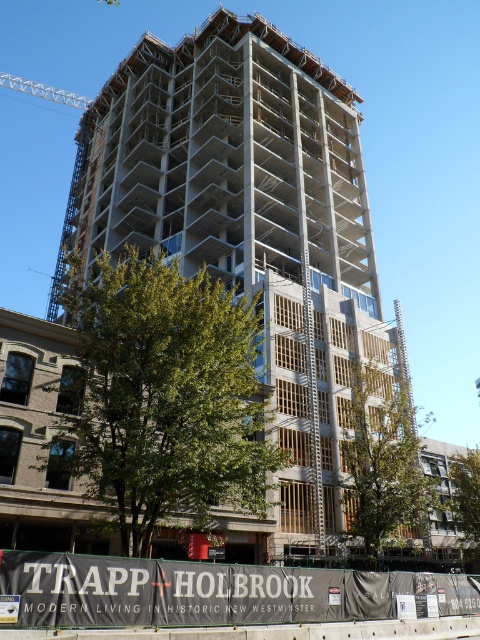
You are a construction worker standing at the entrance of the site. You need to move the white metallic crane at upper left to the left side of the white concrete building at center. Is the current position of the crane already on the left side of the building?

The white concrete building at center is positioned on the right side of white metallic crane at upper left, which means the crane is already on the left side of the building. Therefore, there is no need to move the crane.

You are a construction inspector who needs to assess the gray concrete construction site at center and the white metallic crane at upper left. Which of the two occupies a smaller area in the image?

The gray concrete construction site at center occupies less space than the white metallic crane at upper left, so the gray concrete construction site at center occupies a smaller area in the image.

You are a construction worker standing at the base of the gray concrete construction site at center. You need to lift a heavy beam to the top floor. The white metallic crane at upper left is available. Can the crane reach the top of the construction site? Explain why.

The gray concrete construction site at center is not as tall as the white metallic crane at upper left, so the crane can reach the top of the construction site because it is taller than the site.